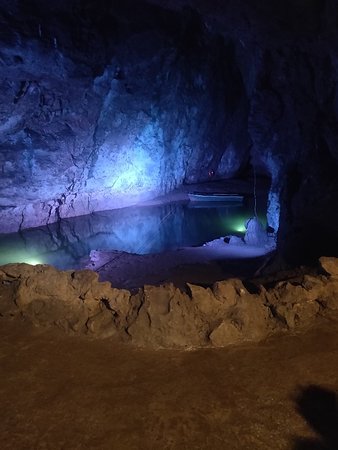
Locate an element on the screen. This screenshot has height=450, width=338. green light is located at coordinates (241, 224), (35, 259).